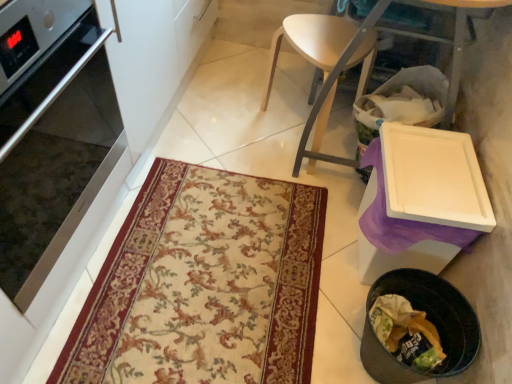
Locate an element on the screen. The height and width of the screenshot is (384, 512). free space between satin silver oven at left and light wood chair at center is located at coordinates (198, 185).